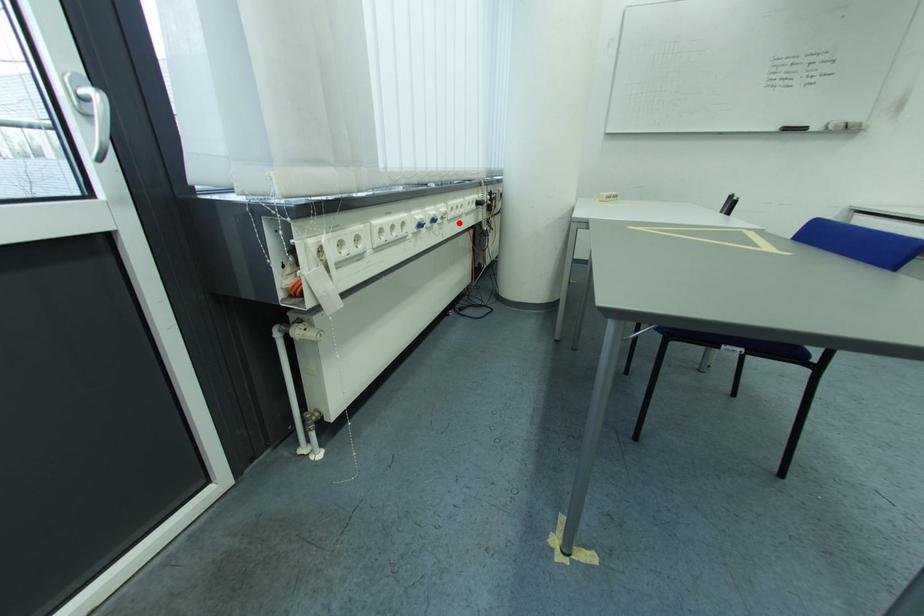
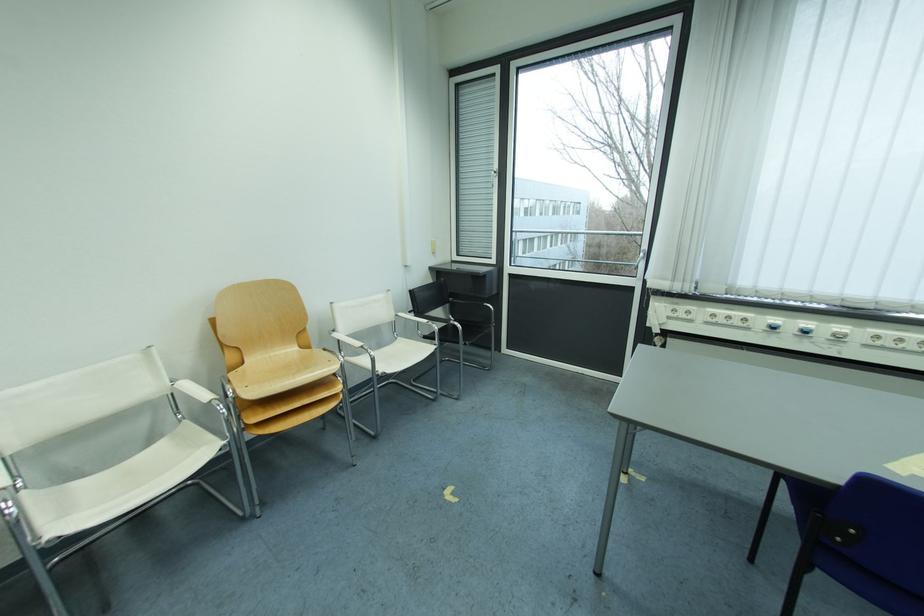
Locate, in the second image, the point that corresponds to the highlighted location in the first image.

(874, 347)